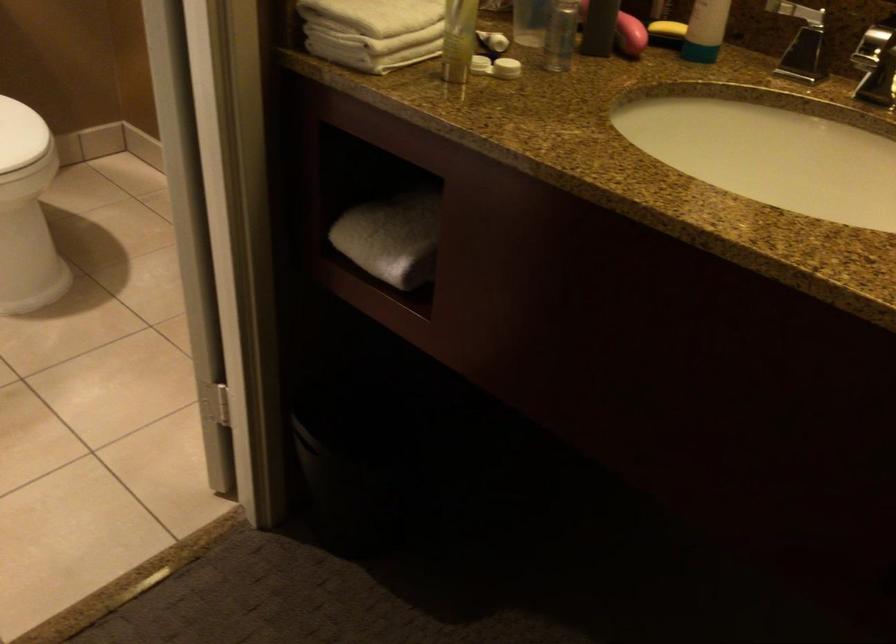
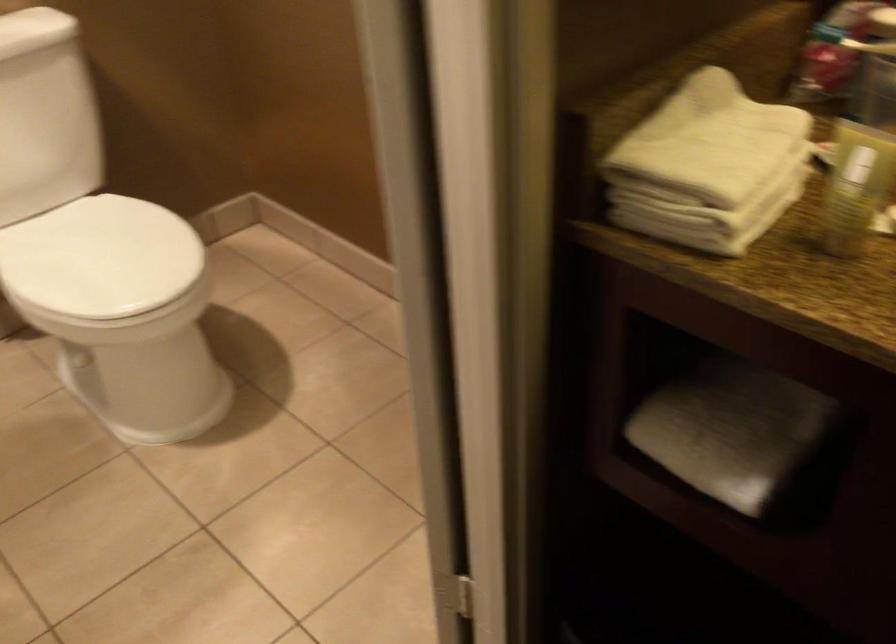
Question: The first image is from the beginning of the video and the second image is from the end. How did the camera likely rotate when shooting the video?

Choices:
 (A) Left
 (B) Right
 (C) Up
 (D) Down

Answer: (A)